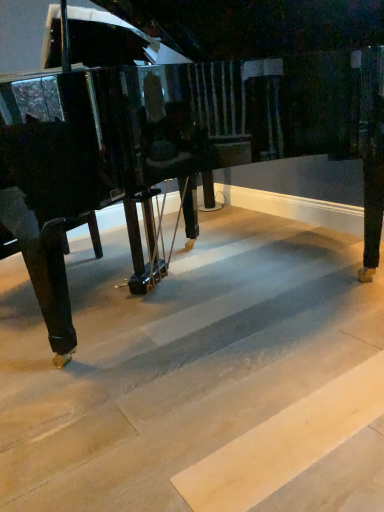
The image size is (384, 512). Describe the element at coordinates (166, 147) in the screenshot. I see `glossy black piano at center` at that location.

Where is `glossy black piano at center`? glossy black piano at center is located at coordinates (166, 147).

The image size is (384, 512). In order to click on light wood stair at center in this screenshot , I will do `click(174, 359)`.

Describe the element at coordinates (174, 359) in the screenshot. Image resolution: width=384 pixels, height=512 pixels. I see `light wood stair at center` at that location.

What are the coordinates of `glossy black piano at center` in the screenshot? It's located at (166, 147).

Between glossy black piano at center and light wood stair at center, which one appears on the right side from the viewer's perspective?

glossy black piano at center.

Which object is further away from the camera, glossy black piano at center or light wood stair at center?

glossy black piano at center is behind.

Between point (279, 108) and point (258, 397), which one is positioned behind?

The point (279, 108) is farther.

From the image's perspective, who appears lower, glossy black piano at center or light wood stair at center?

light wood stair at center.

From a real-world perspective, is glossy black piano at center positioned above or below light wood stair at center?

glossy black piano at center is situated higher than light wood stair at center in the real world.

In the scene shown: Can you confirm if glossy black piano at center is wider than light wood stair at center?

No.

Does glossy black piano at center have a greater height compared to light wood stair at center?

Indeed, glossy black piano at center has a greater height compared to light wood stair at center.

Can you confirm if glossy black piano at center is bigger than light wood stair at center?

Correct, glossy black piano at center is larger in size than light wood stair at center.

Is glossy black piano at center outside of light wood stair at center?

glossy black piano at center is positioned outside light wood stair at center.

Is glossy black piano at center touching light wood stair at center?

No, glossy black piano at center is not in contact with light wood stair at center.

Is glossy black piano at center oriented away from light wood stair at center?

No, glossy black piano at center is not facing away from light wood stair at center.

Can you tell me how much glossy black piano at center and light wood stair at center differ in facing direction?

They differ by 36.5 degrees in their facing directions.

Measure the distance from glossy black piano at center to light wood stair at center.

glossy black piano at center and light wood stair at center are 23.74 inches apart from each other.

You are a GUI agent. You are given a task and a screenshot of the screen. Output one action in this format:
    pyautogui.click(x=<x>, y=<y>)
    Task: Click on the stair on the left of the glossy black piano at center
    The image size is (384, 512).
    Given the screenshot: What is the action you would take?
    pyautogui.click(x=174, y=359)

Is light wood stair at center at the right side of glossy black piano at center?

In fact, light wood stair at center is to the left of glossy black piano at center.

Which object is more forward, light wood stair at center or glossy black piano at center?

light wood stair at center is in front.

Between point (118, 373) and point (193, 158), which one is positioned behind?

The point (193, 158) is farther from the camera.

Consider the image. From the image's perspective, which one is positioned higher, light wood stair at center or glossy black piano at center?

glossy black piano at center is shown above in the image.

From a real-world perspective, is light wood stair at center positioned above or below glossy black piano at center?

In terms of real-world spatial position, light wood stair at center is below glossy black piano at center.

Is light wood stair at center wider than glossy black piano at center?

Yes, light wood stair at center is wider than glossy black piano at center.

Considering the sizes of light wood stair at center and glossy black piano at center in the image, is light wood stair at center taller or shorter than glossy black piano at center?

In the image, light wood stair at center appears to be shorter than glossy black piano at center.

Which of these two, light wood stair at center or glossy black piano at center, is bigger?

glossy black piano at center.

Is light wood stair at center completely or partially outside of glossy black piano at center?

Yes, light wood stair at center is outside of glossy black piano at center.

Is light wood stair at center next to glossy black piano at center and touching it?

light wood stair at center and glossy black piano at center are not in contact.

Is light wood stair at center turned away from glossy black piano at center?

No, glossy black piano at center is not at the back of light wood stair at center.

I want to click on piano that appears above the light wood stair at center (from a real-world perspective), so click(x=166, y=147).

There is a light wood stair at center. Where is `piano above it (from a real-world perspective)`? The width and height of the screenshot is (384, 512). piano above it (from a real-world perspective) is located at coordinates (166, 147).

Identify the location of stair below the glossy black piano at center (from the image's perspective). (174, 359).